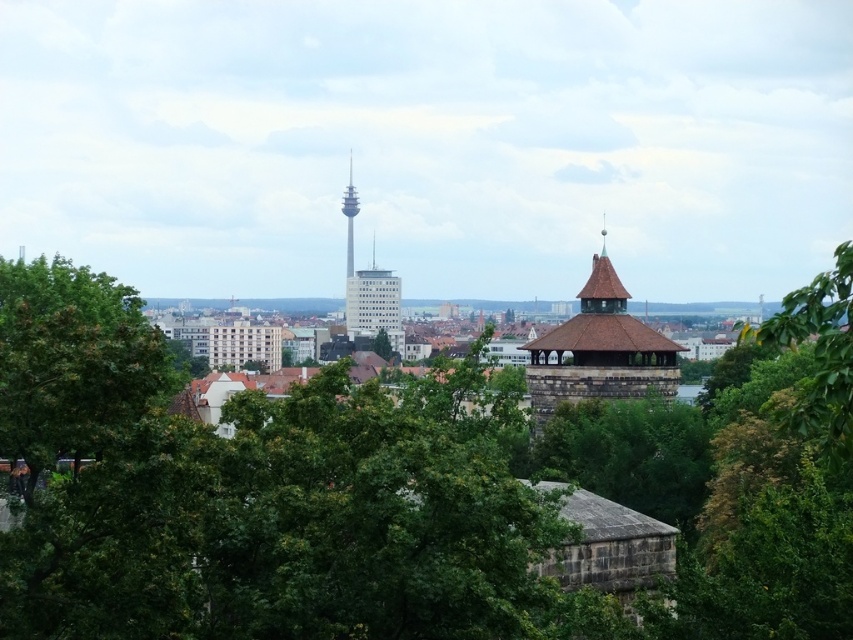
You are an urban planner analyzing this cityscape. You need to determine which object occupies more space in the image between the green leafy tree at right and the smooth glass tower at center. Based on the scene, which one is bigger?

The green leafy tree at right is larger in size than the smooth glass tower at center, so the green leafy tree at right occupies more space in the image.

Looking at this image, you are standing at the point marked by the coordinates point (622, 301) in the cityscape image. You want to take a photo of the stone tower with reddish brown tiled roof on the right and the modern buildings on the left. Is the distance between you and the stone tower with reddish brown tiled roof on the right and the modern buildings on the left sufficient to capture both in a single frame?

The distance between you and the stone tower with reddish brown tiled roof on the right and the modern buildings on the left is 190.91 meters. Since both structures are in the midground of the cityscape, they are likely within the same general area, so capturing both in a single frame would depend on the camera lens used. However, the question specifies the distance from the viewer to the point, not between the two structures. Given the information provided, we cannot determine if both can be captured in a

You are a drone operator planning to fly a drone from the green leafy tree at right to the smooth glass tower at center. Based on the scene, will the drone have an unobstructed path? Explain your reasoning.

The green leafy tree at right is in front of the smooth glass tower at center, so the drone will have an unobstructed path from the tree to the tower since the tree is closer to the observer and the tower is behind it.